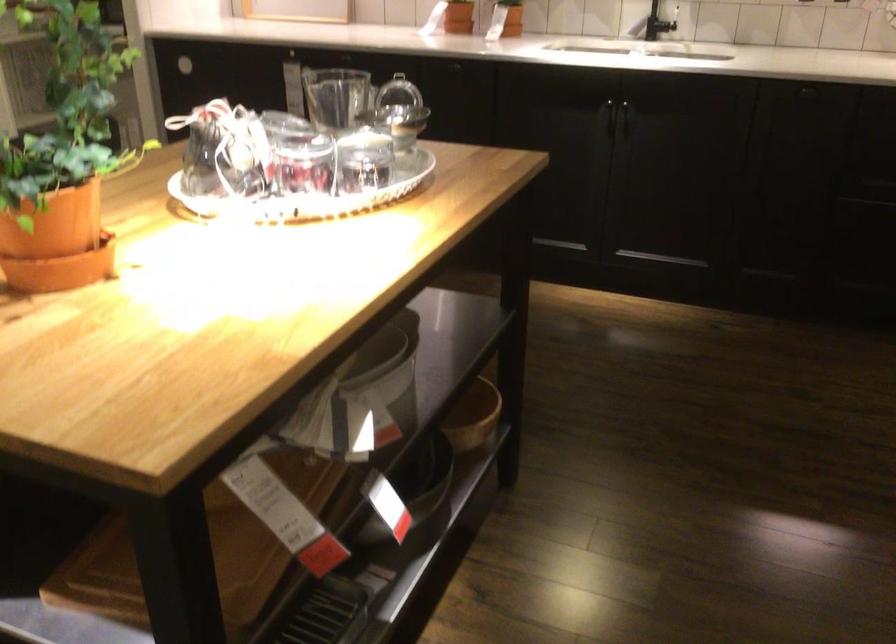
You are a GUI agent. You are given a task and a screenshot of the screen. Output one action in this format:
    pyautogui.click(x=<x>, y=<y>)
    Task: Click on the white bucket
    This screenshot has width=896, height=644.
    Given the screenshot: What is the action you would take?
    pyautogui.click(x=362, y=397)